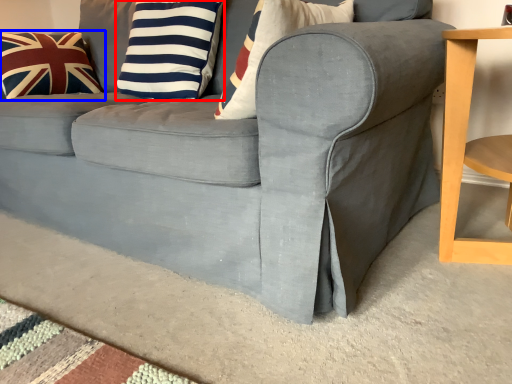
Question: Which object is closer to the camera taking this photo, pillow (highlighted by a red box) or pillow (highlighted by a blue box)?

Choices:
 (A) pillow
 (B) pillow

Answer: (A)